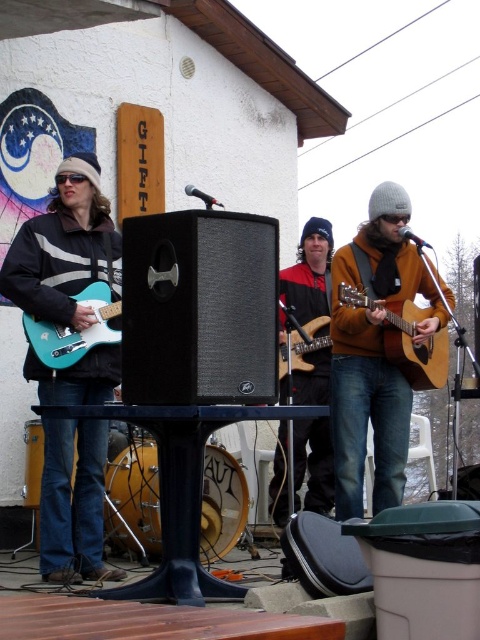
You are a photographer at the live music performance and need to capture the matte black guitar at left. Where exactly should you aim your camera?

The matte black guitar at left is located at point (64, 248), so aim your camera there to capture it.

You are a stagehand setting up for a performance. You need to place a new amplifier that is 1.2 meters wide between the orange matte guitar at center and the teal glossy electric guitar at left. Based on the space between them, will the amplifier fit?

The orange matte guitar at center occupies less space than the teal glossy electric guitar at left. Since the amplifier is 1.2 meters wide, but the space between the guitars isn